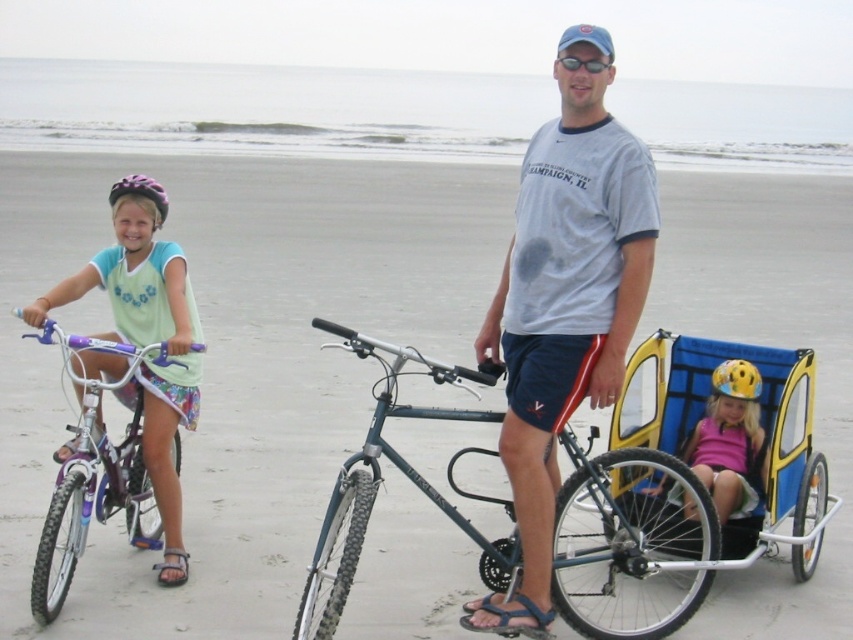
You are a delivery person who needs to place a package on the purple matte bicycle helmet at upper left. The package is 1.2 meters long. Can you place it on the helmet without moving the purple metallic bicycle at left?

The purple metallic bicycle at left is 1.17 meters away from the purple matte bicycle helmet at upper left. Since the package is 1.2 meters long, it would extend beyond the space between them, so you cannot place it there without moving the bicycle.